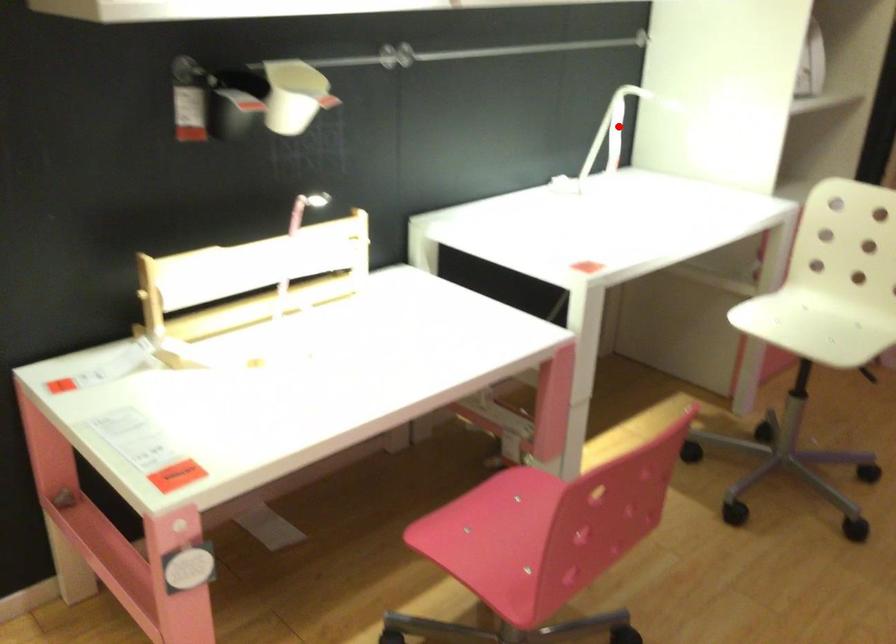
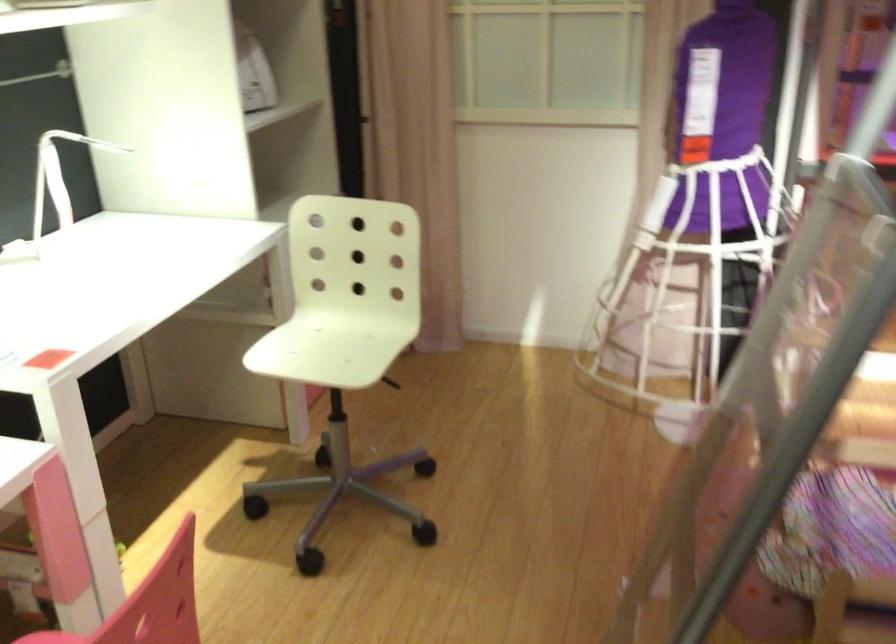
Question: I am providing you with two images of the same scene from different viewpoints. A red point is marked on the first image. At the location where the point appears in image 1, is it still visible in image 2?

Choices:
 (A) Yes
 (B) No

Answer: (B)